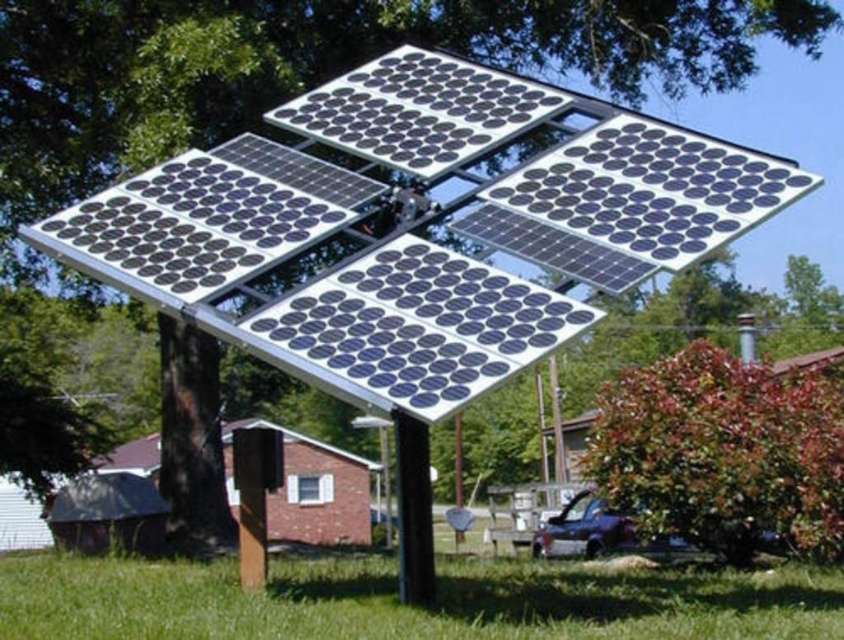
Question: Is silver/black solar panel at center to the left of brown shingles at lower center from the viewer's perspective?

Choices:
 (A) yes
 (B) no

Answer: (B)

Question: Which point appears farthest from the camera in this image?

Choices:
 (A) (418, 504)
 (B) (448, 330)

Answer: (A)

Question: Does green leafy tree at lower right appear on the right side of black metallic pole at center?

Choices:
 (A) yes
 (B) no

Answer: (A)

Question: Which object is closer to the camera taking this photo?

Choices:
 (A) green leafy tree at lower right
 (B) brown shingles at lower center

Answer: (A)

Question: Which of the following is the farthest from the observer?

Choices:
 (A) silver/black solar panel at center
 (B) green leafy tree at lower right
 (C) black matte solar panel at upper center

Answer: (B)

Question: Does black matte solar panel at upper center have a smaller size compared to brown shingles at lower center?

Choices:
 (A) no
 (B) yes

Answer: (B)